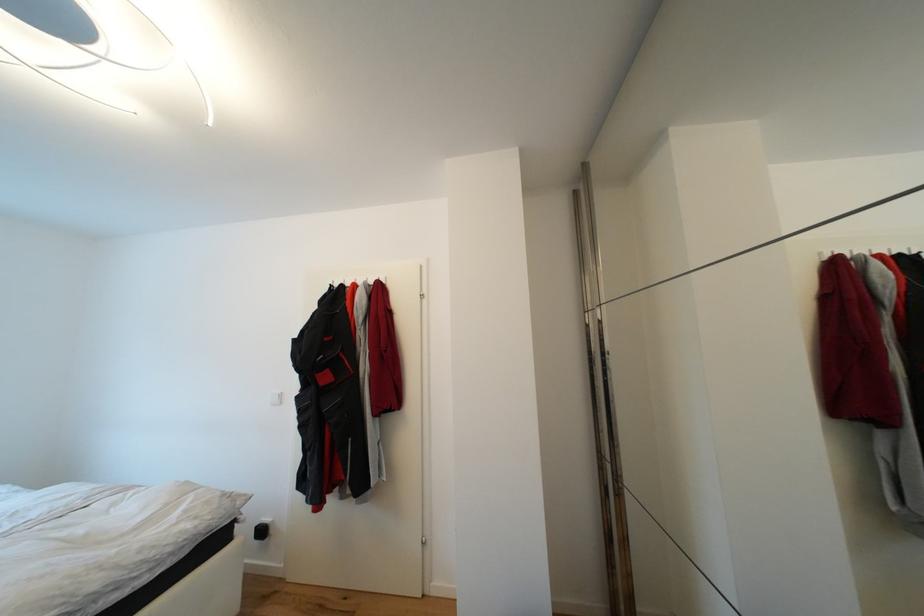
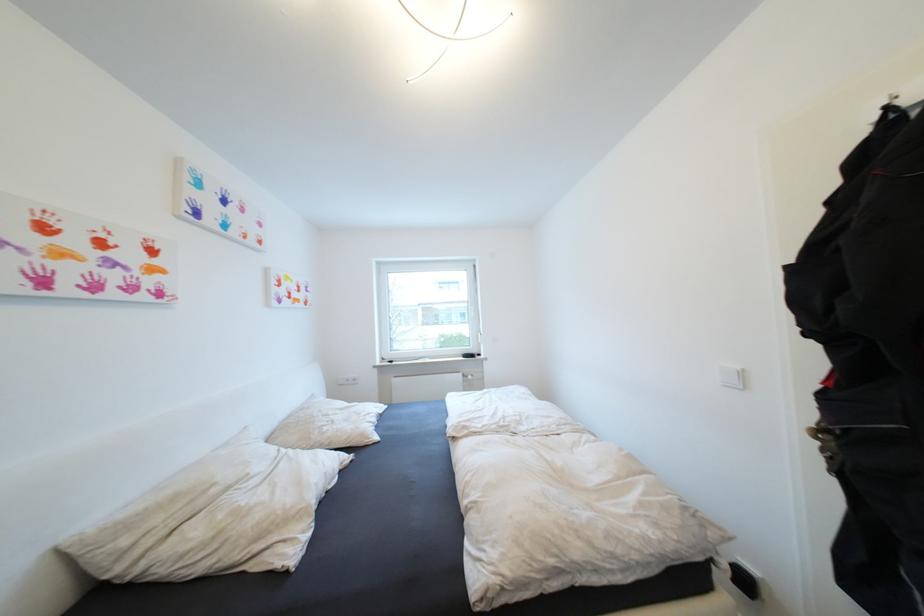
Question: The images are taken continuously from a first-person perspective. In which direction is your viewpoint rotating?

Choices:
 (A) Left
 (B) Right
 (C) Up
 (D) Down

Answer: (A)